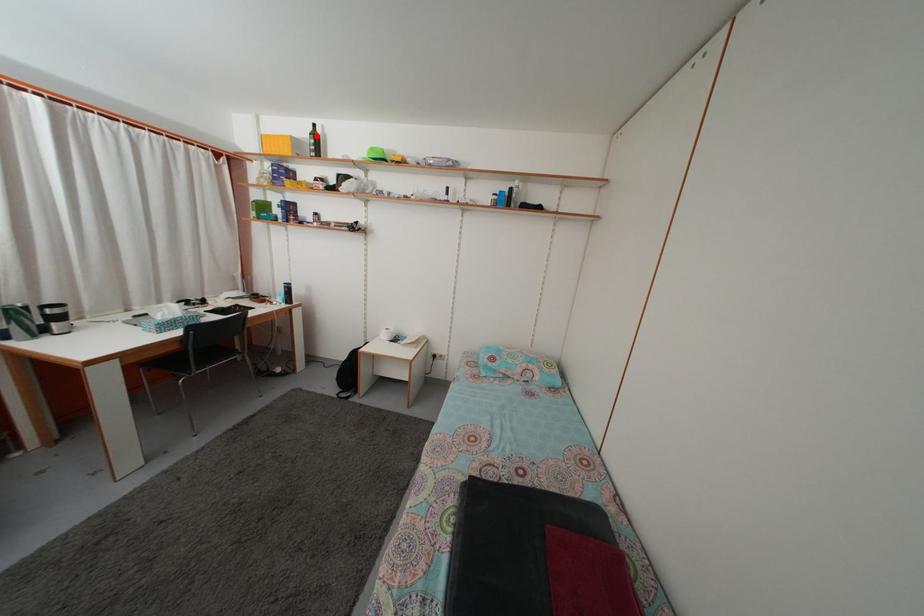
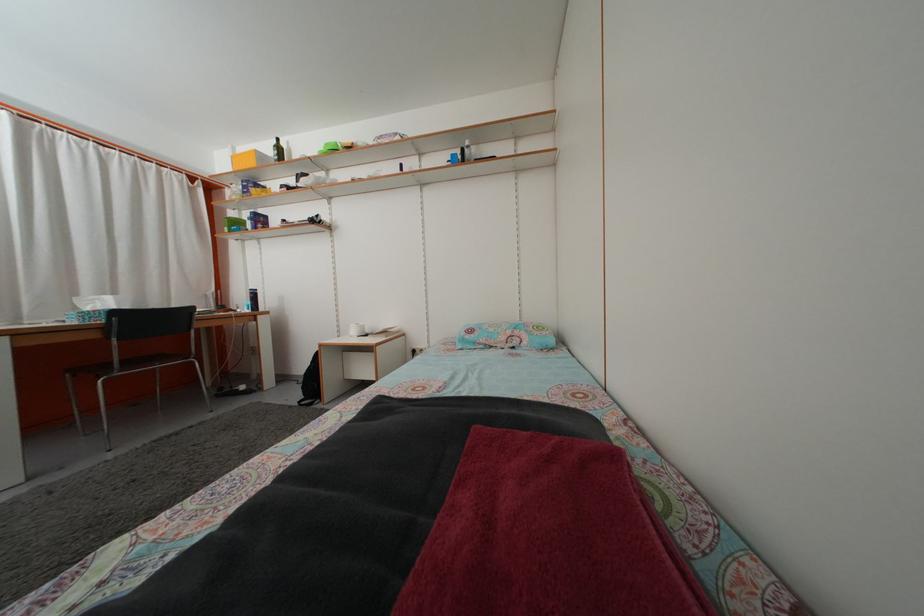
The point at the highlighted location is marked in the first image. Where is the corresponding point in the second image?

(281, 148)